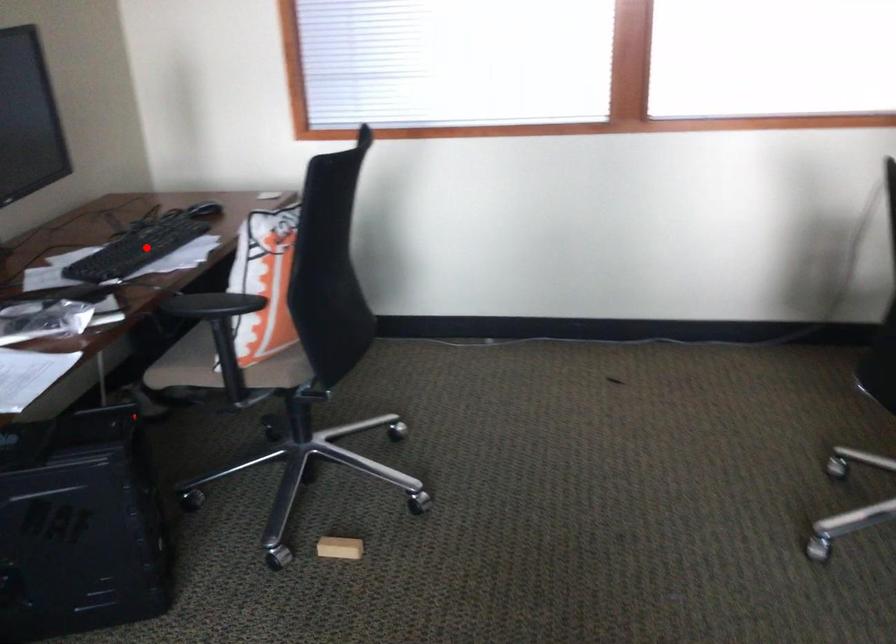
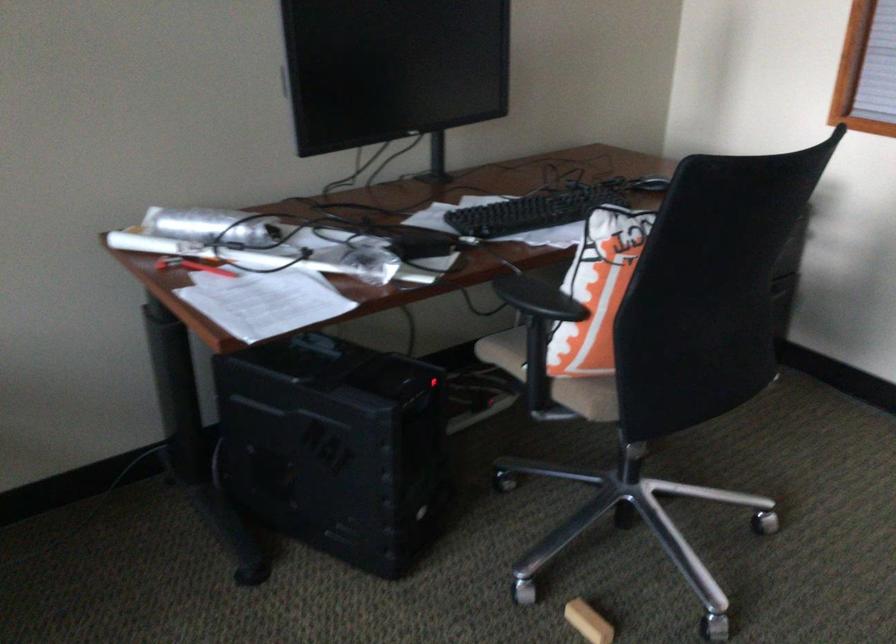
The point at the highlighted location is marked in the first image. Where is the corresponding point in the second image?

(532, 211)